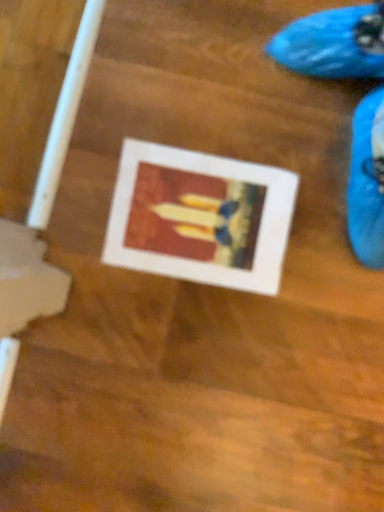
Find the location of a particular element. The width and height of the screenshot is (384, 512). white matte picture frame at center is located at coordinates (200, 217).

What do you see at coordinates (200, 217) in the screenshot?
I see `white matte picture frame at center` at bounding box center [200, 217].

What is the approximate width of white matte picture frame at center?

white matte picture frame at center is 11.95 inches wide.

You are a GUI agent. You are given a task and a screenshot of the screen. Output one action in this format:
    pyautogui.click(x=<x>, y=<y>)
    Task: Click on the white matte picture frame at center
    The image size is (384, 512).
    Given the screenshot: What is the action you would take?
    pyautogui.click(x=200, y=217)